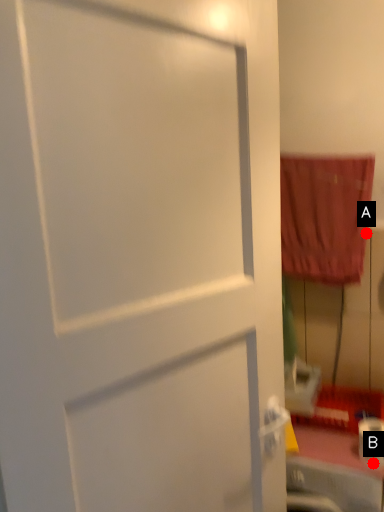
Question: Two points are circled on the image, labeled by A and B beside each circle. Among these points, which one is farthest from the camera?

Choices:
 (A) A is further
 (B) B is further

Answer: (A)